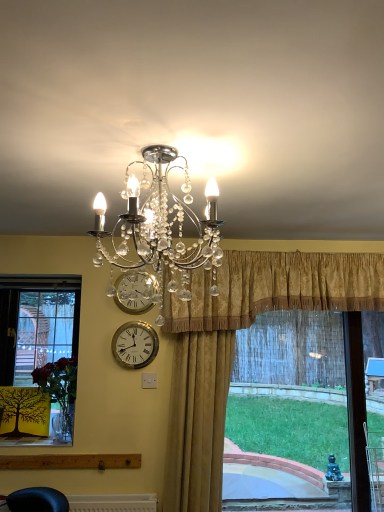
Question: In which direction should I rotate to look at gold damask curtain at center, placed as the first curtain when sorted from right to left?

Choices:
 (A) left
 (B) right

Answer: (B)

Question: Is gold metallic wall clock at lower center directly adjacent to gold damask curtain at center, placed as the first curtain when sorted from right to left?

Choices:
 (A) no
 (B) yes

Answer: (A)

Question: Is gold metallic wall clock at lower center positioned beyond the bounds of gold damask curtain at center, which is counted as the second curtain, starting from the left?

Choices:
 (A) no
 (B) yes

Answer: (B)

Question: Is gold metallic wall clock at lower center thinner than gold damask curtain at center, placed as the first curtain when sorted from right to left?

Choices:
 (A) yes
 (B) no

Answer: (A)

Question: Considering the relative sizes of gold metallic wall clock at lower center and gold damask curtain at center, which is counted as the second curtain, starting from the left, in the image provided, is gold metallic wall clock at lower center shorter than gold damask curtain at center, which is counted as the second curtain, starting from the left,?

Choices:
 (A) yes
 (B) no

Answer: (A)

Question: From the image's perspective, is gold metallic wall clock at lower center below gold damask curtain at center, placed as the first curtain when sorted from right to left?

Choices:
 (A) yes
 (B) no

Answer: (A)

Question: Is gold metallic wall clock at lower center further to the viewer compared to gold damask curtain at center, placed as the first curtain when sorted from right to left?

Choices:
 (A) yes
 (B) no

Answer: (A)

Question: From a real-world perspective, is clear crystal chandelier at upper center over gold metallic clock at upper center?

Choices:
 (A) no
 (B) yes

Answer: (B)

Question: Is clear crystal chandelier at upper center to the left of gold metallic clock at upper center from the viewer's perspective?

Choices:
 (A) no
 (B) yes

Answer: (A)

Question: Can you confirm if clear crystal chandelier at upper center is wider than gold metallic clock at upper center?

Choices:
 (A) yes
 (B) no

Answer: (A)

Question: Does clear crystal chandelier at upper center appear on the right side of gold metallic clock at upper center?

Choices:
 (A) yes
 (B) no

Answer: (A)

Question: Can you confirm if clear crystal chandelier at upper center is shorter than gold metallic clock at upper center?

Choices:
 (A) no
 (B) yes

Answer: (A)

Question: Is clear crystal chandelier at upper center bigger than gold metallic clock at upper center?

Choices:
 (A) no
 (B) yes

Answer: (B)

Question: Does gold velvet curtain at center, which appears as the first curtain when viewed from the left, touch clear crystal chandelier at upper center?

Choices:
 (A) no
 (B) yes

Answer: (A)